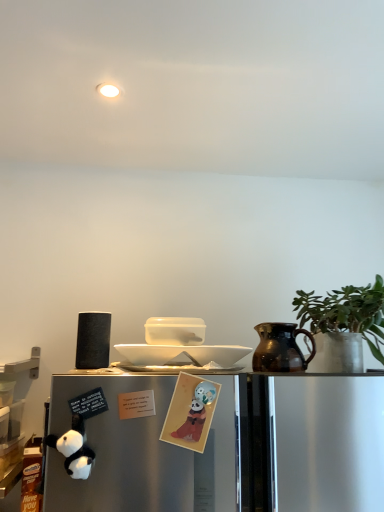
Question: Does white plush panda at lower left, which is counted as the first toy, starting from the left, have a lesser width compared to matte paper card at center, which is the 2th toy from left to right?

Choices:
 (A) no
 (B) yes

Answer: (A)

Question: Does white plush panda at lower left, which is counted as the first toy, starting from the left, appear on the left side of matte paper card at center, which is the 2th toy from left to right?

Choices:
 (A) yes
 (B) no

Answer: (A)

Question: Would you say white plush panda at lower left, which is counted as the first toy, starting from the left, contains matte paper card at center, which is the 2th toy from left to right?

Choices:
 (A) no
 (B) yes

Answer: (A)

Question: Is white plush panda at lower left, which is counted as the first toy, starting from the left, oriented towards matte paper card at center, which appears as the first toy when viewed from the right?

Choices:
 (A) yes
 (B) no

Answer: (B)

Question: Can you confirm if white plush panda at lower left, the 2th toy when ordered from right to left, is shorter than matte paper card at center, which appears as the first toy when viewed from the right?

Choices:
 (A) yes
 (B) no

Answer: (A)

Question: Considering the relative sizes of white plush panda at lower left, which is counted as the first toy, starting from the left, and matte paper card at center, which is the 2th toy from left to right, in the image provided, is white plush panda at lower left, which is counted as the first toy, starting from the left, taller than matte paper card at center, which is the 2th toy from left to right,?

Choices:
 (A) no
 (B) yes

Answer: (A)

Question: Is white glossy plate at center shorter than matte black speaker at left?

Choices:
 (A) no
 (B) yes

Answer: (B)

Question: From the image's perspective, would you say white glossy plate at center is positioned over matte black speaker at left?

Choices:
 (A) yes
 (B) no

Answer: (B)

Question: Does white glossy plate at center have a lesser width compared to matte black speaker at left?

Choices:
 (A) no
 (B) yes

Answer: (A)

Question: Is white glossy plate at center positioned behind matte black speaker at left?

Choices:
 (A) no
 (B) yes

Answer: (A)

Question: Is matte black speaker at left surrounded by white glossy plate at center?

Choices:
 (A) yes
 (B) no

Answer: (B)

Question: Is white glossy plate at center directly adjacent to matte black speaker at left?

Choices:
 (A) yes
 (B) no

Answer: (B)

Question: Does white glossy plate at center come behind green matte plant at right?

Choices:
 (A) yes
 (B) no

Answer: (B)